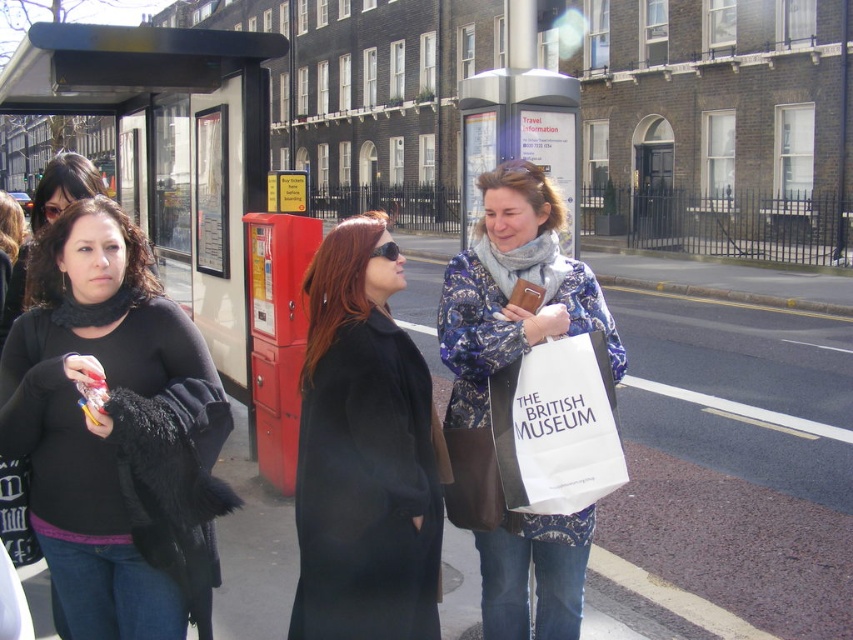
Is black fuzzy coat at left below floral-patterned coat at center?

Yes, black fuzzy coat at left is below floral-patterned coat at center.

Is black fuzzy coat at left wider than floral-patterned coat at center?

Correct, the width of black fuzzy coat at left exceeds that of floral-patterned coat at center.

Locate an element on the screen. The width and height of the screenshot is (853, 640). black fuzzy coat at left is located at coordinates coord(115,433).

Is smooth concrete pavement at center positioned behind black fuzzy coat at left?

That is True.

Which of these two, smooth concrete pavement at center or black fuzzy coat at left, stands shorter?

Standing shorter between the two is black fuzzy coat at left.

Describe the element at coordinates (730, 468) in the screenshot. I see `smooth concrete pavement at center` at that location.

This screenshot has width=853, height=640. I want to click on smooth concrete pavement at center, so click(730, 468).

Consider the image. Which is more to the left, smooth concrete pavement at center or black wool coat at center?

From the viewer's perspective, black wool coat at center appears more on the left side.

Is smooth concrete pavement at center wider than black wool coat at center?

Indeed, smooth concrete pavement at center has a greater width compared to black wool coat at center.

Does point (453, 634) come in front of point (395, 451)?

No, (453, 634) is behind (395, 451).

The image size is (853, 640). What are the coordinates of `smooth concrete pavement at center` in the screenshot? It's located at (730, 468).